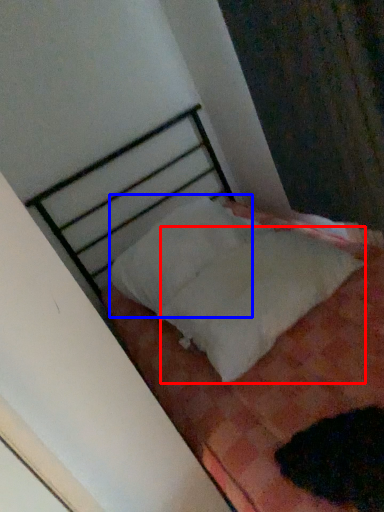
Question: Which of the following is the closest to the observer, sheet (highlighted by a red box) or pillow (highlighted by a blue box)?

Choices:
 (A) sheet
 (B) pillow

Answer: (A)